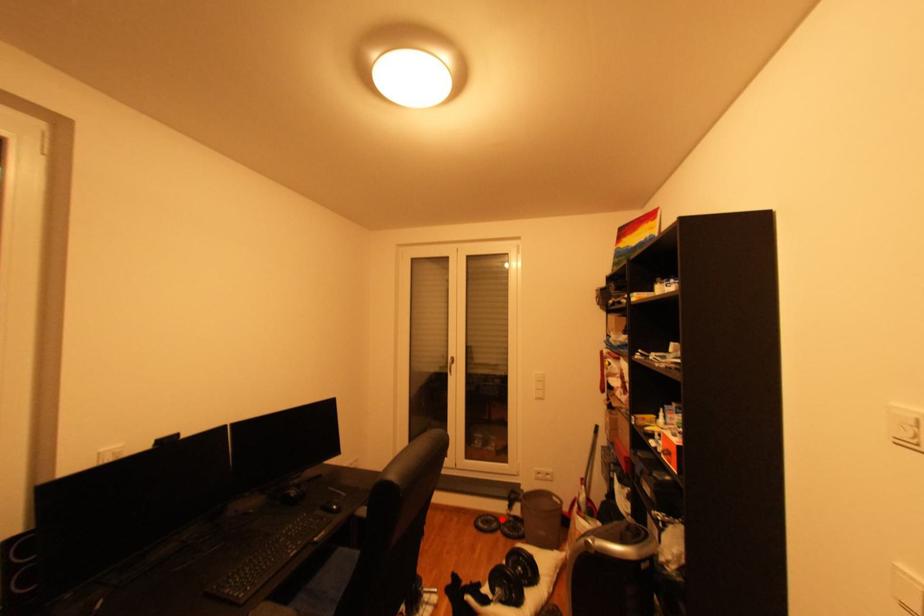
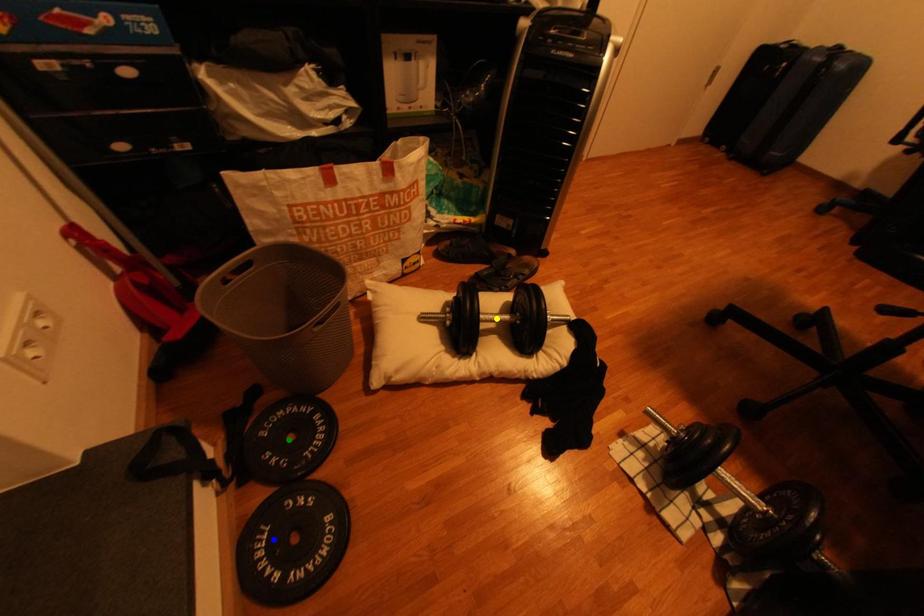
Question: I am providing you with two images of the same scene from different viewpoints. A red point is marked on the first image. You are given multiple points on the second image. Can you choose the point in image 2 that corresponds to the point in image 1?

Choices:
 (A) yellow point
 (B) green point
 (C) blue point

Answer: (C)